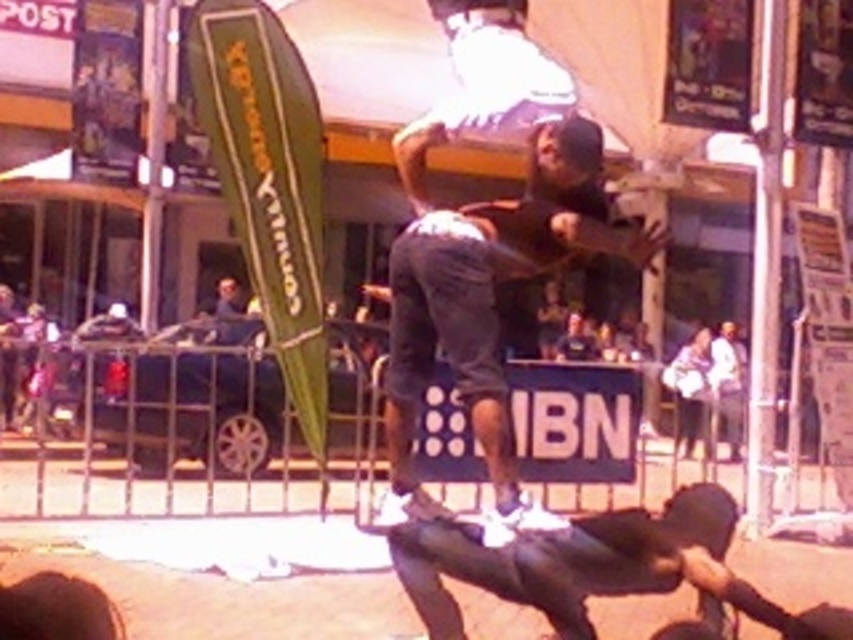
You are a photographer standing at the camera position. You want to capture a closeup shot of the dark gray denim shorts at center. Given that your camera can focus on objects within 5 meters, will you be able to get a clear closeup?

The dark gray denim shorts at center is 6.33 meters from the camera, which is beyond the 5 meter focus range. You will not be able to get a clear closeup.

You are a photographer trying to capture both the dark gray denim shorts at center and the dark gray matte skateboard at lower center in a single frame. Which object should you zoom in on to ensure both are clearly visible without cropping?

The dark gray denim shorts at center is larger in size than the dark gray matte skateboard at lower center. To include both in the frame without cropping, you should zoom out slightly to accommodate the larger object, which is the dark gray denim shorts at center.

You are a photographer trying to capture the perfect shot of the dark gray denim shorts at center. Given that your camera focuses on the point at coordinates point (488,294), will the shorts be in focus?

The dark gray denim shorts at center is represented by point (488,294), so yes, the shorts will be in focus since the camera focuses on that exact point.